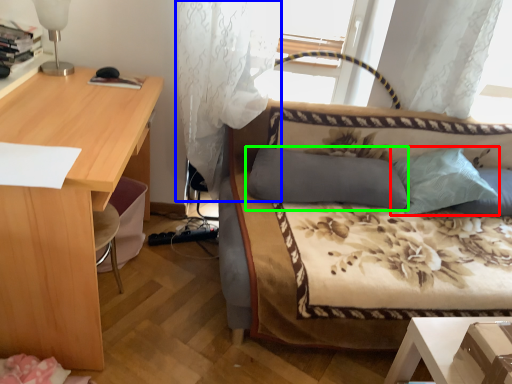
Question: Which is farther away from pillow (highlighted by a red box)? curtain (highlighted by a blue box) or pillow (highlighted by a green box)?

Choices:
 (A) curtain
 (B) pillow

Answer: (A)